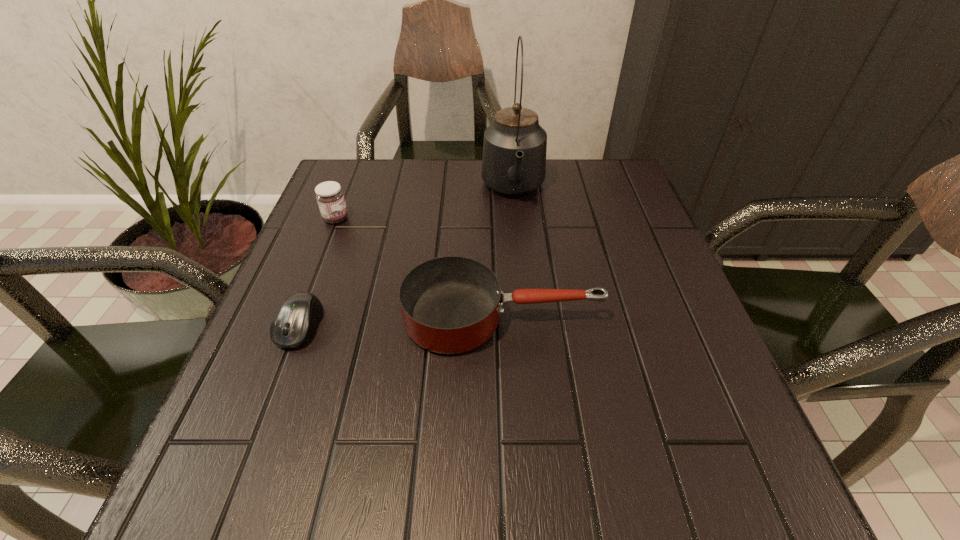
Image resolution: width=960 pixels, height=540 pixels. What are the coordinates of `the tallest object` in the screenshot? It's located at (514, 150).

Where is `jam`? Image resolution: width=960 pixels, height=540 pixels. jam is located at coordinates (329, 195).

Locate an element on the screen. The image size is (960, 540). pan is located at coordinates (452, 304).

You are a GUI agent. You are given a task and a screenshot of the screen. Output one action in this format:
    pyautogui.click(x=<x>, y=<y>)
    Task: Click on the shortest object
    
    Given the screenshot: What is the action you would take?
    pyautogui.click(x=293, y=324)

Where is `vacant space located spout on the tallest object`? vacant space located spout on the tallest object is located at coordinates (526, 321).

At what (x,y) coordinates should I click in order to perform the action: click on vacant space located 0.350m on the front label of the jam. Please return your answer as a coordinate pair (x, y). This screenshot has height=540, width=960. Looking at the image, I should click on (497, 219).

Where is `free space located on the handle side of the pan`? free space located on the handle side of the pan is located at coordinates (651, 318).

Find the location of `vacant space situated on the right of the shortest object`. vacant space situated on the right of the shortest object is located at coordinates (392, 326).

Locate an element on the screen. object positioned at the far edge is located at coordinates (514, 150).

This screenshot has width=960, height=540. I want to click on jam that is at the left edge, so click(x=329, y=195).